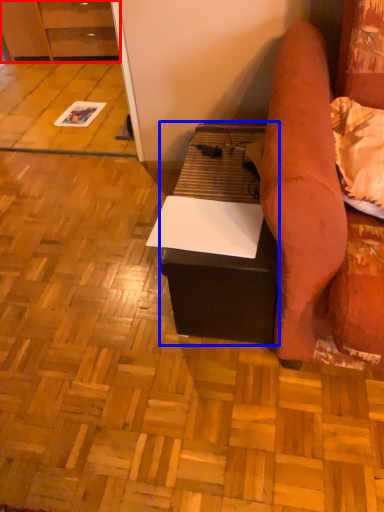
Question: Which object appears farthest to the camera in this image, cabinetry (highlighted by a red box) or table (highlighted by a blue box)?

Choices:
 (A) cabinetry
 (B) table

Answer: (A)